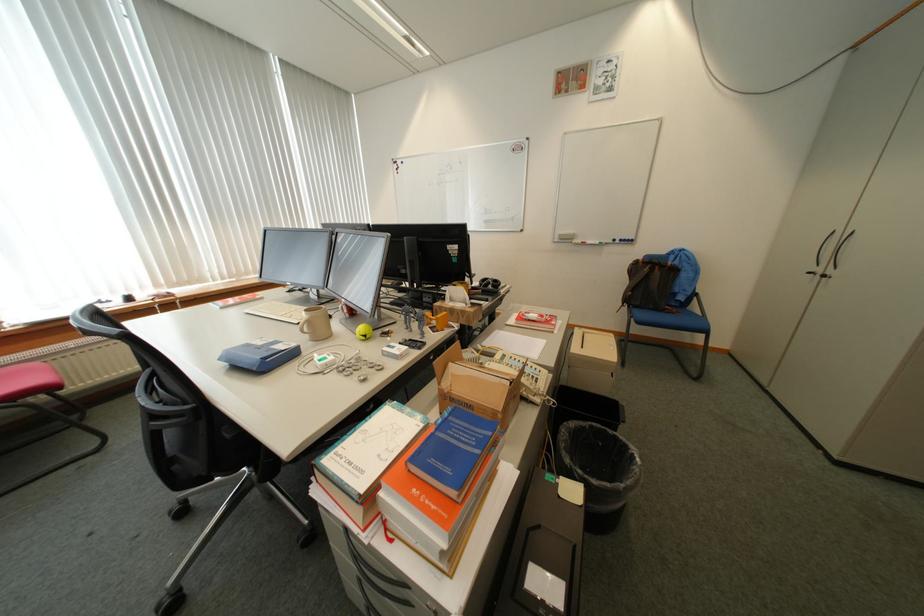
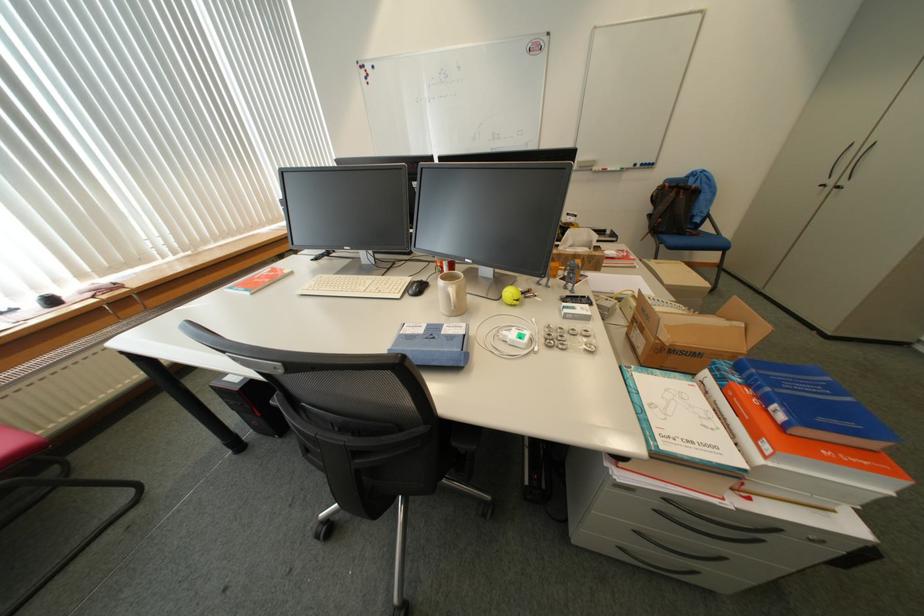
Question: The images are taken continuously from a first-person perspective. In which direction is your viewpoint rotating?

Choices:
 (A) Left
 (B) Right
 (C) Up
 (D) Down

Answer: (D)